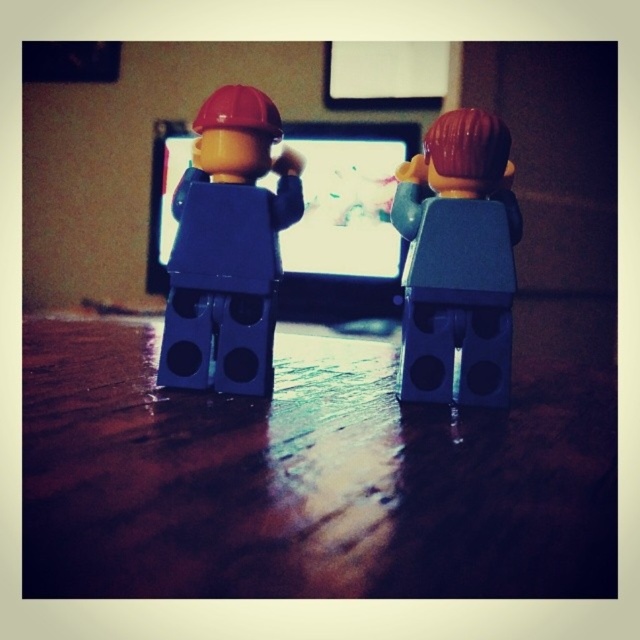
Is the position of wooden table at center more distant than that of matte gray minifigure at center?

That is False.

Between wooden table at center and matte gray minifigure at center, which one appears on the left side from the viewer's perspective?

From the viewer's perspective, wooden table at center appears more on the left side.

Find the location of a particular element. wooden table at center is located at coordinates (305, 477).

Locate an element on the screen. The width and height of the screenshot is (640, 640). wooden table at center is located at coordinates (305, 477).

Can you confirm if wooden table at center is positioned below matte blue minifigure at center?

Indeed, wooden table at center is positioned under matte blue minifigure at center.

Does point (35, 449) come in front of point (208, 189)?

Yes.

Identify the location of wooden table at center. The image size is (640, 640). (305, 477).

Is point (212, 120) in front of point (161, 291)?

Yes, it is.

Consider the image. Is matte blue minifigure at center to the left of matte plastic computer screen at center from the viewer's perspective?

Indeed, matte blue minifigure at center is positioned on the left side of matte plastic computer screen at center.

Is point (216, 189) positioned in front of point (292, 282)?

Yes, point (216, 189) is closer to viewer.

Locate an element on the screen. Image resolution: width=640 pixels, height=640 pixels. matte blue minifigure at center is located at coordinates (227, 248).